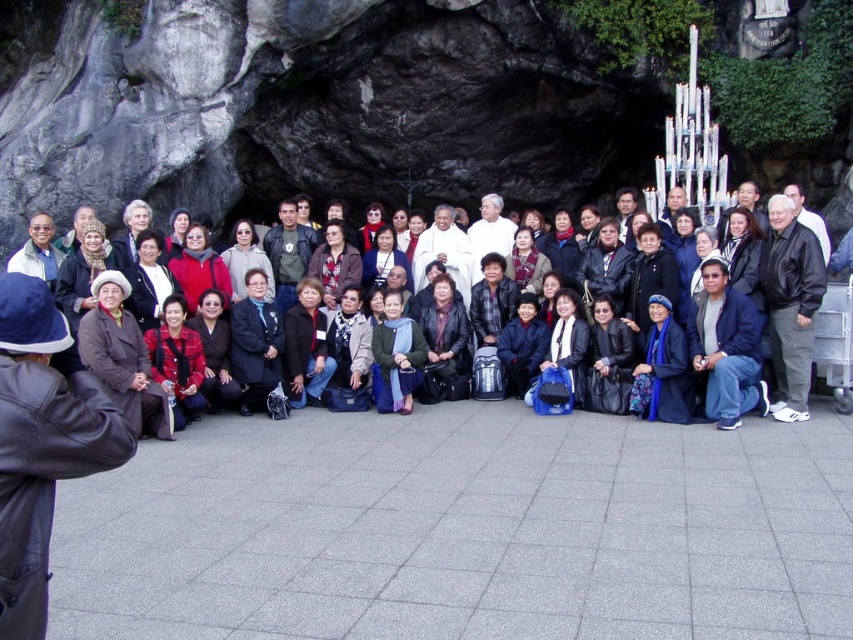
Does matte black jacket at center have a lesser width compared to black leather jacket at lower right?

In fact, matte black jacket at center might be wider than black leather jacket at lower right.

Does matte black jacket at center come in front of black leather jacket at lower right?

Yes, it is.

This screenshot has width=853, height=640. Identify the location of matte black jacket at center. point(743,330).

Where is `matte black jacket at center`? This screenshot has height=640, width=853. matte black jacket at center is located at coordinates (743, 330).

Is point (729, 289) farther from viewer compared to point (752, 326)?

Yes, point (729, 289) is farther from viewer.

Locate an element on the screen. The width and height of the screenshot is (853, 640). matte black jacket at center is located at coordinates (743, 330).

Between black leather jacket at lower right and dark blue jacket at center, which one has less height?

Standing shorter between the two is dark blue jacket at center.

This screenshot has width=853, height=640. I want to click on black leather jacket at lower right, so click(790, 305).

Is point (805, 348) closer to camera compared to point (718, 269)?

Yes, it is in front of point (718, 269).

Identify the location of black leather jacket at lower right. (790, 305).